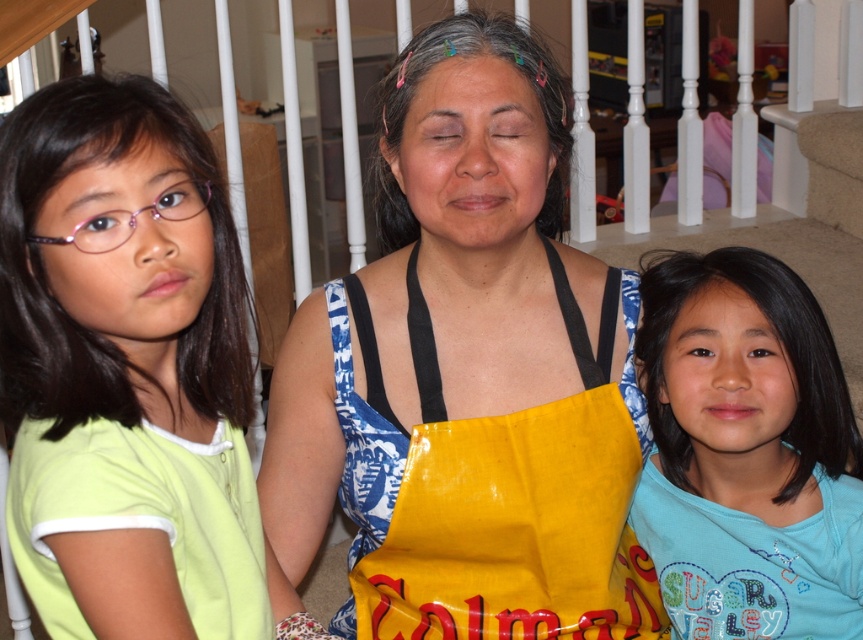
Question: Does light green shirt at left appear under yellow fabric apron at center?

Choices:
 (A) no
 (B) yes

Answer: (A)

Question: Is the position of light green shirt at left more distant than that of blue cotton shirt at right?

Choices:
 (A) no
 (B) yes

Answer: (A)

Question: Based on their relative distances, which object is nearer to the light green shirt at left?

Choices:
 (A) blue cotton shirt at right
 (B) yellow fabric apron at center

Answer: (B)

Question: Among these points, which one is farthest from the camera?

Choices:
 (A) (213, 422)
 (B) (721, 406)

Answer: (B)

Question: Does light green shirt at left appear on the left side of blue cotton shirt at right?

Choices:
 (A) yes
 (B) no

Answer: (A)

Question: Which of these objects is positioned farthest from the light green shirt at left?

Choices:
 (A) blue cotton shirt at right
 (B) yellow fabric apron at center

Answer: (A)